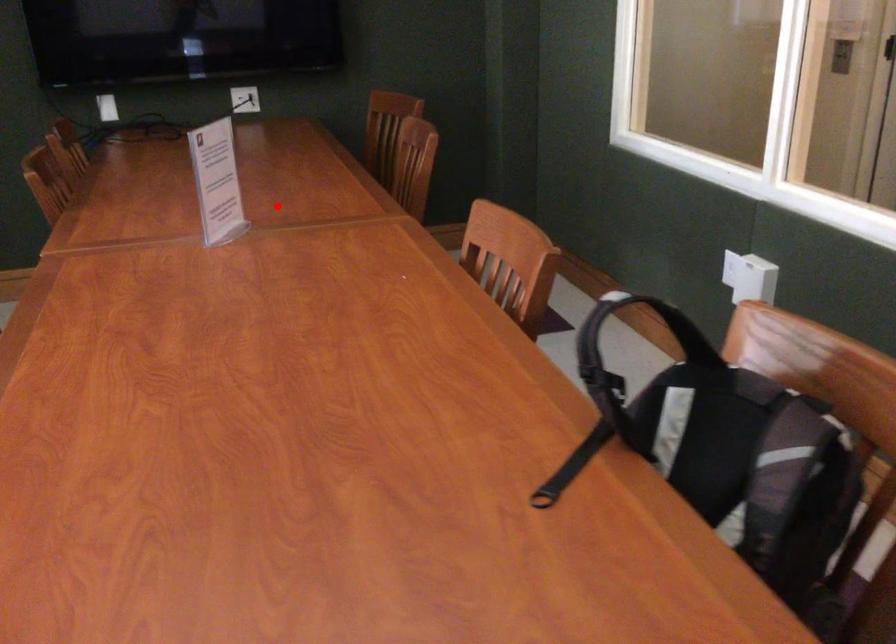
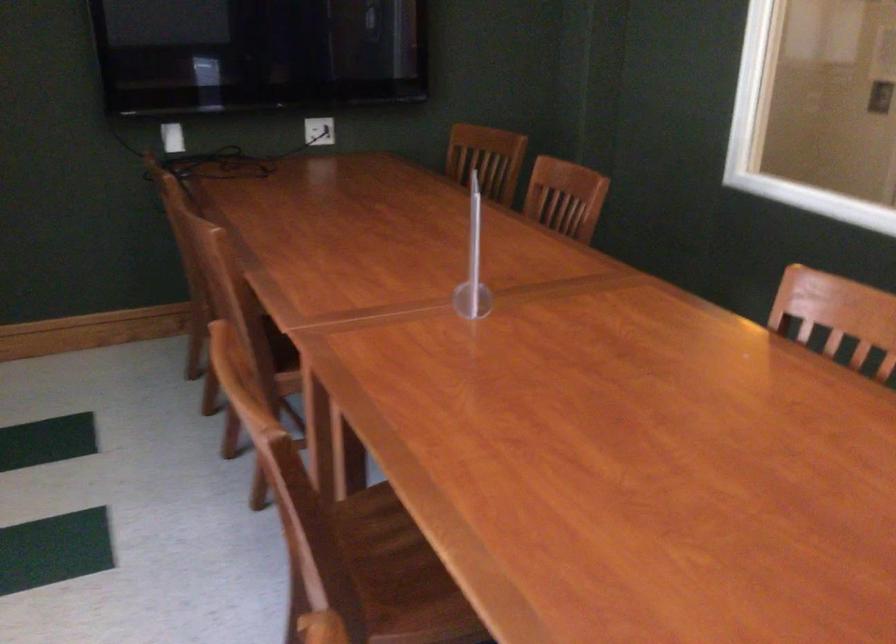
Where in the second image is the point corresponding to the highlighted location from the first image?

(472, 263)